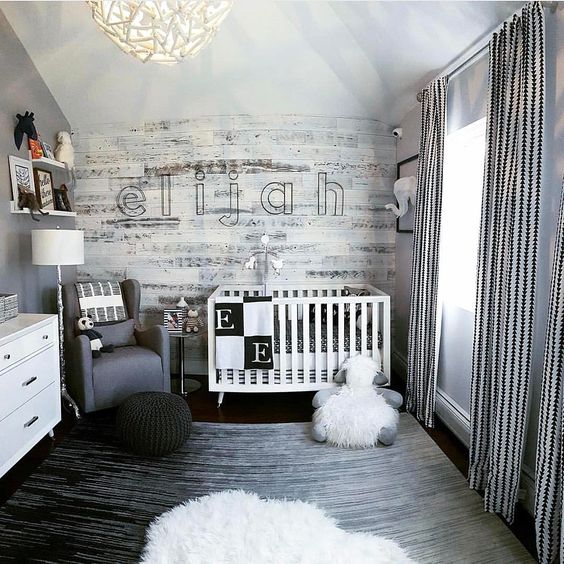
This screenshot has width=564, height=564. In order to click on wooden floor in this screenshot , I will do `click(123, 493)`.